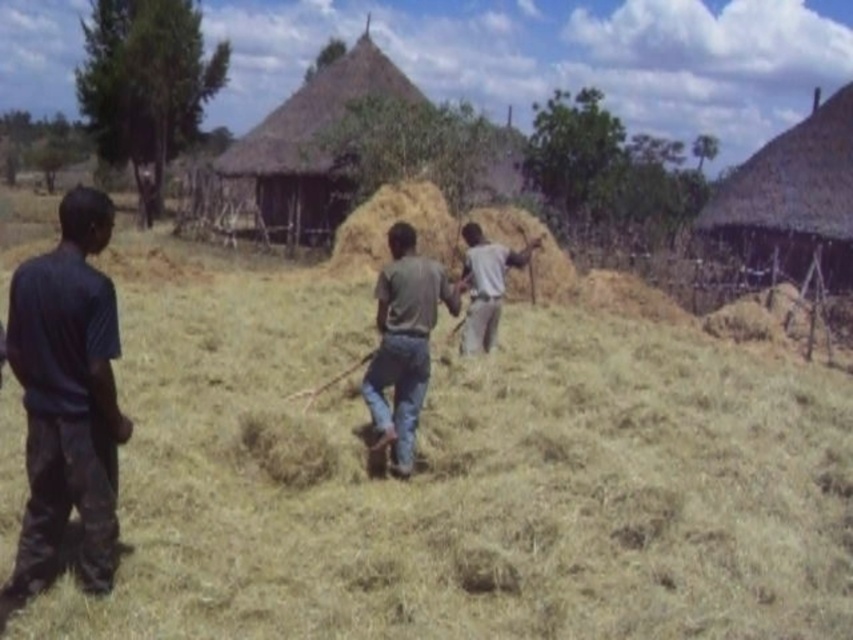
You are a visitor in this rural area and want to approach the two workers near the hay pile. Which direction should you walk from the dark blue shirt at left to reach the gray matte shirt at center?

You should walk to the right from the dark blue shirt at left to reach the gray matte shirt at center since the dark blue shirt at left is positioned to the left of the gray matte shirt at center.

You are standing at the point marked by the coordinates point (457, 477) in the image. What object are you currently standing on?

You are standing on dry straw at center, as the coordinates point (457, 477) corresponds to dry straw at center according to the description.

You are standing at the center of the field and want to walk to the dark blue shirt at left. Which direction should you head?

You should head to the left since the dark blue shirt at left is located at the left side of the image.